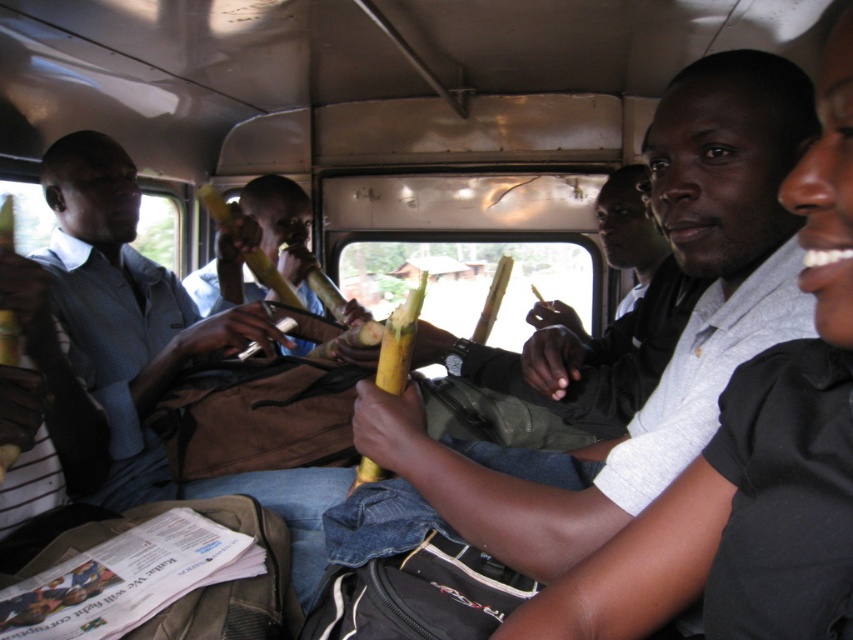
You are a passenger on a bus and you want to choose a banana to eat. Both the smooth yellow banana at center and the smooth brown banana at center are available. Which one is bigger?

The smooth yellow banana at center is larger in size compared to the smooth brown banana at center, so you should choose the smooth yellow banana at center.

You are a passenger sitting at the point with coordinates point (112,371) and want to reach the banana held by someone near point (764,298). Is there a clear path to walk directly towards the banana without obstacles?

Point (764,298) is in front of point (112,371), so the path is clear for you to walk directly towards the banana held by someone near point (764,298).